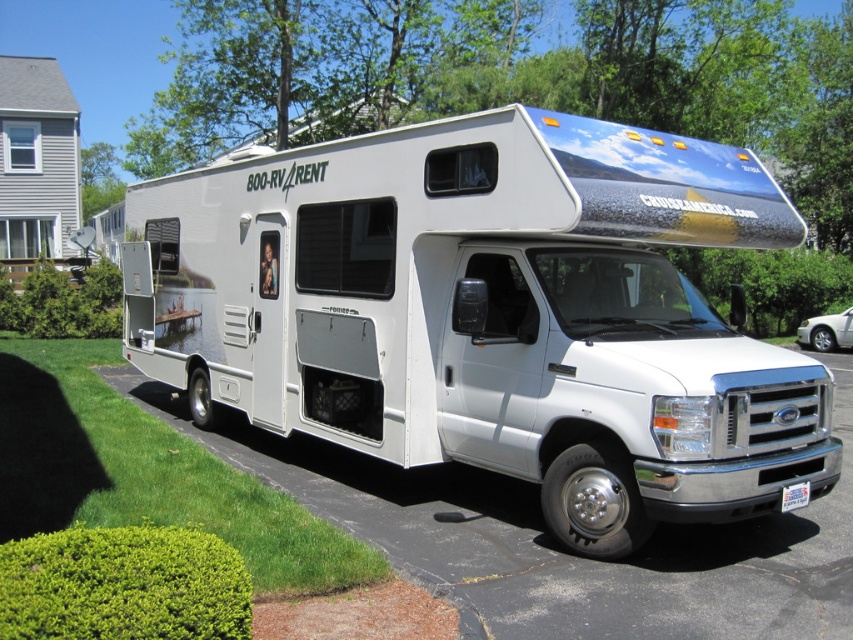
Question: Can you confirm if white glossy recreational vehicle at center is positioned above white asphalt driveway at lower center?

Choices:
 (A) yes
 (B) no

Answer: (A)

Question: Does white glossy recreational vehicle at center appear under white asphalt driveway at lower center?

Choices:
 (A) yes
 (B) no

Answer: (B)

Question: From the image, what is the correct spatial relationship of white glossy recreational vehicle at center in relation to white asphalt driveway at lower center?

Choices:
 (A) above
 (B) below

Answer: (A)

Question: Which of the following is the closest to the observer?

Choices:
 (A) (676, 346)
 (B) (483, 477)

Answer: (A)